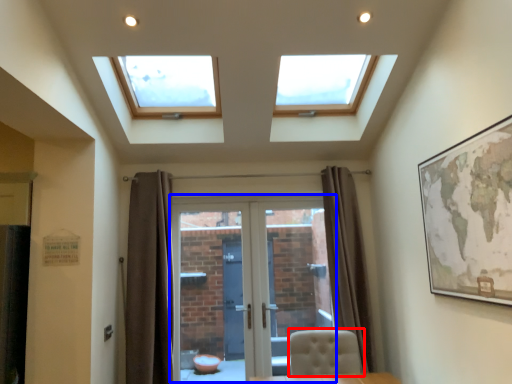
Question: Among these objects, which one is nearest to the camera, chair (highlighted by a red box) or door (highlighted by a blue box)?

Choices:
 (A) chair
 (B) door

Answer: (A)